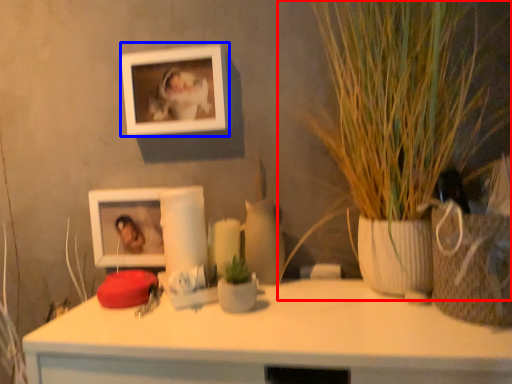
Question: Among these objects, which one is nearest to the camera, houseplant (highlighted by a red box) or picture frame (highlighted by a blue box)?

Choices:
 (A) houseplant
 (B) picture frame

Answer: (A)